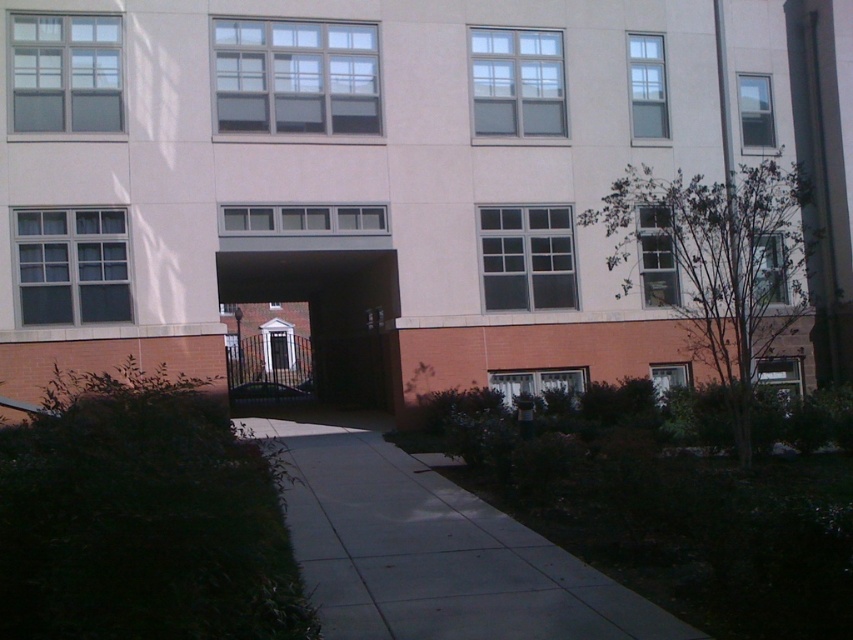
Does gray concrete sidewalk at center have a lesser height compared to dark brown wooden gate at center?

Correct, gray concrete sidewalk at center is not as tall as dark brown wooden gate at center.

Between gray concrete sidewalk at center and dark brown wooden gate at center, which one has more height?

dark brown wooden gate at center is taller.

The width and height of the screenshot is (853, 640). What do you see at coordinates (434, 552) in the screenshot?
I see `gray concrete sidewalk at center` at bounding box center [434, 552].

Find the location of a particular element. The image size is (853, 640). gray concrete sidewalk at center is located at coordinates (434, 552).